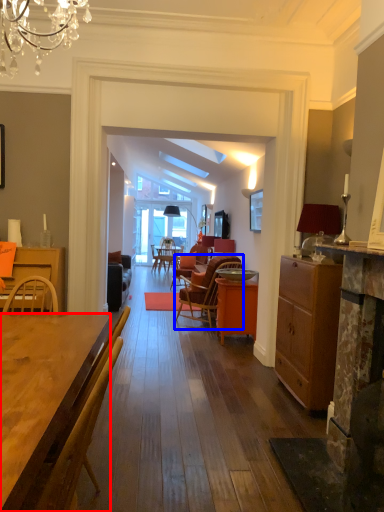
Question: Which object is closer to the camera taking this photo, desk (highlighted by a red box) or chair (highlighted by a blue box)?

Choices:
 (A) desk
 (B) chair

Answer: (A)